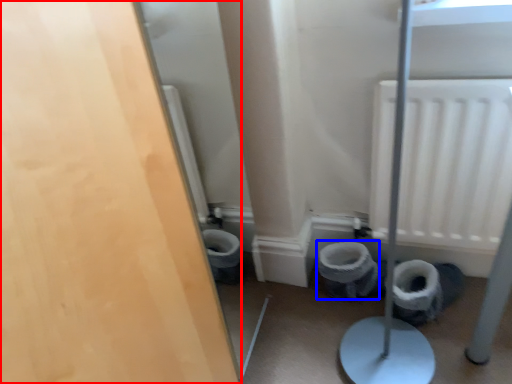
Question: Which of the following is the farthest to the observer, door (highlighted by a red box) or toilet bowl (highlighted by a blue box)?

Choices:
 (A) door
 (B) toilet bowl

Answer: (B)